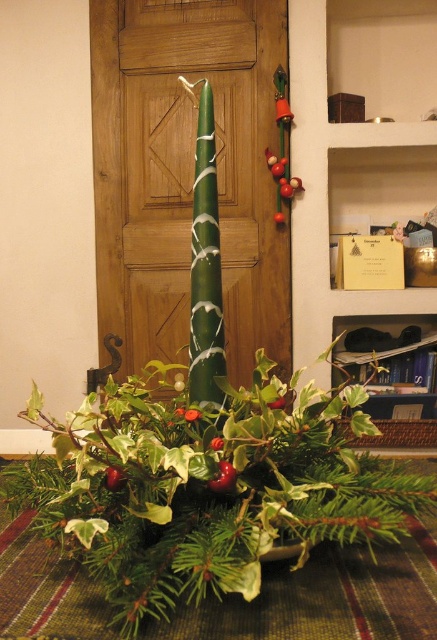
From the picture: You are standing in front of the festive arrangement and want to place a small decoration between the two points, point [172,461] and point [280,72]. Which point is closer to you where you should start placing the decoration?

→ Point [172,461] is closer to the viewer than point [280,72], so you should start placing the decoration near point [172,461] first.

You are setting up a holiday decoration and need to ensure the green matte candle at center is visible. Is the metallic green ornament at upper center blocking its view from the front?

The green matte candle at center is in front of the metallic green ornament at upper center, so the candle is not blocked and remains visible from the front.

You are an interior designer assessing the space for a new shelf. You see the matte brown wood bookshelf at upper center and the metallic green ornament at upper center. Which object is taller?

The matte brown wood bookshelf at upper center is taller than the metallic green ornament at upper center.